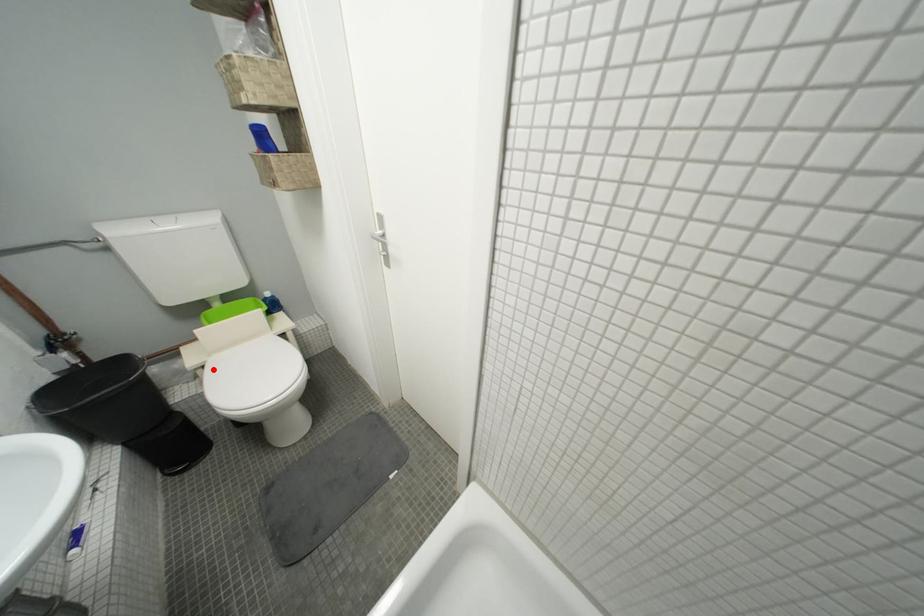
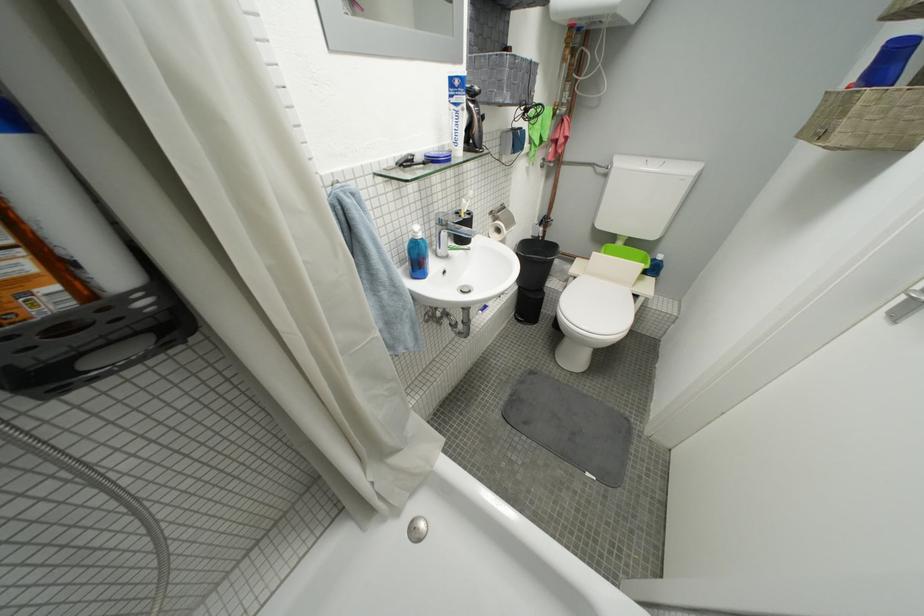
The point at the highlighted location is marked in the first image. Where is the corresponding point in the second image?

(584, 281)